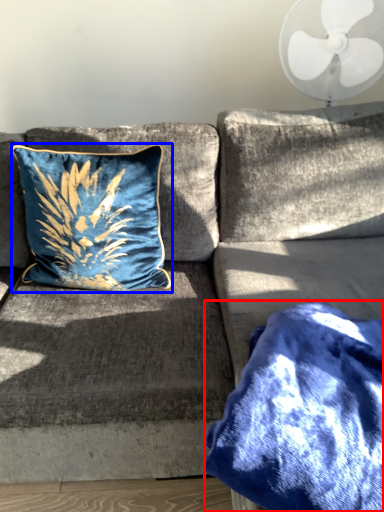
Question: Which point is closer to the camera, blanket (highlighted by a red box) or pillow (highlighted by a blue box)?

Choices:
 (A) blanket
 (B) pillow

Answer: (A)